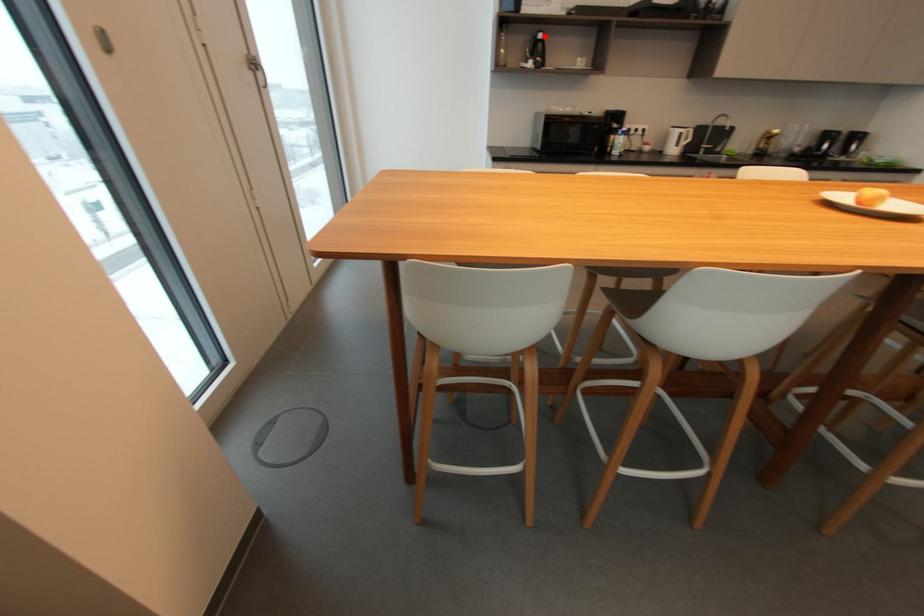
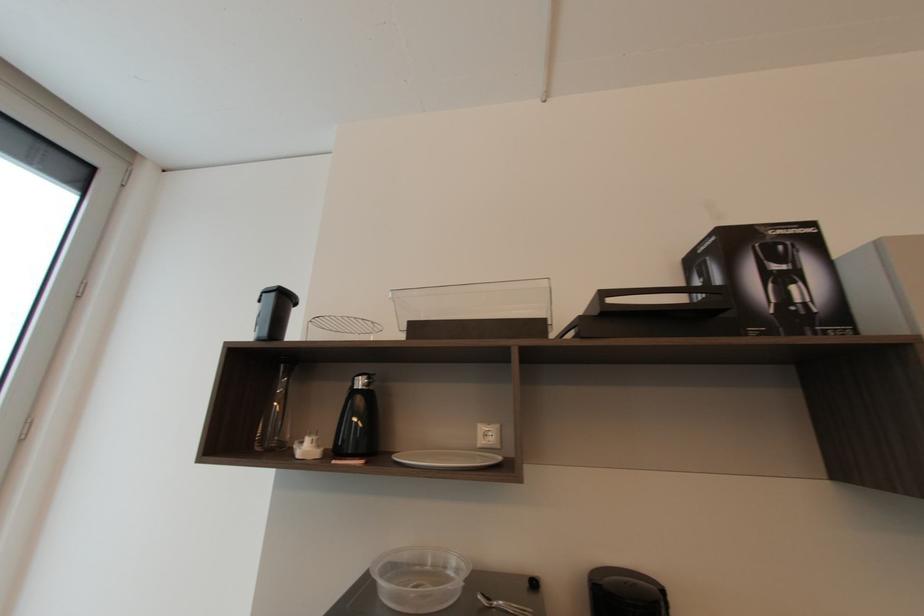
In the second image, find the point that corresponds to the highlighted location in the first image.

(362, 384)